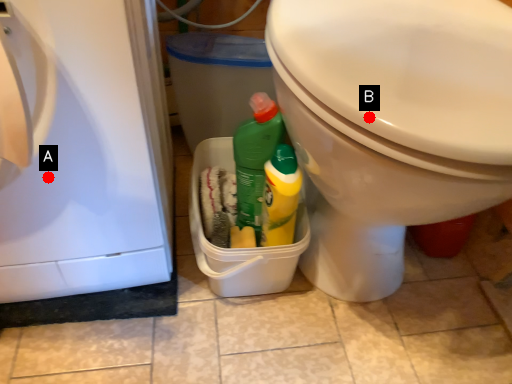
Question: Two points are circled on the image, labeled by A and B beside each circle. Among these points, which one is nearest to the camera?

Choices:
 (A) A is closer
 (B) B is closer

Answer: (B)